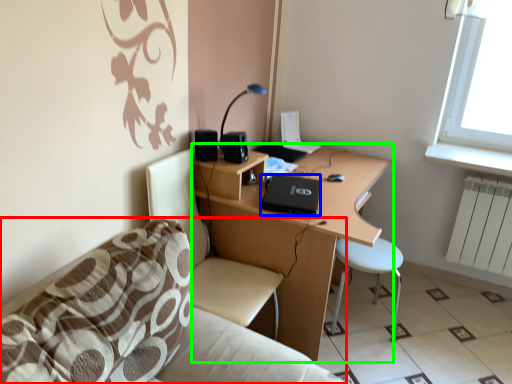
Question: Considering the real-world distances, which object is closest to studio couch (highlighted by a red box)? laptop (highlighted by a blue box) or desk (highlighted by a green box).

Choices:
 (A) laptop
 (B) desk

Answer: (B)